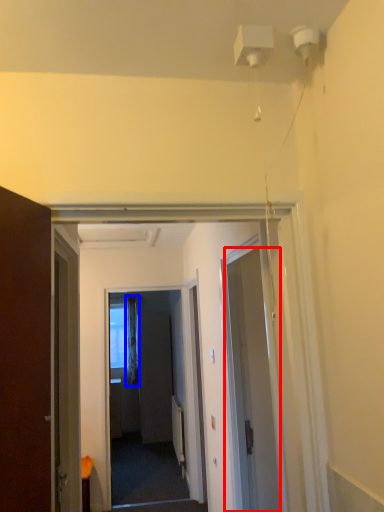
Question: Which object is closer to the camera taking this photo, door (highlighted by a red box) or curtain (highlighted by a blue box)?

Choices:
 (A) door
 (B) curtain

Answer: (A)